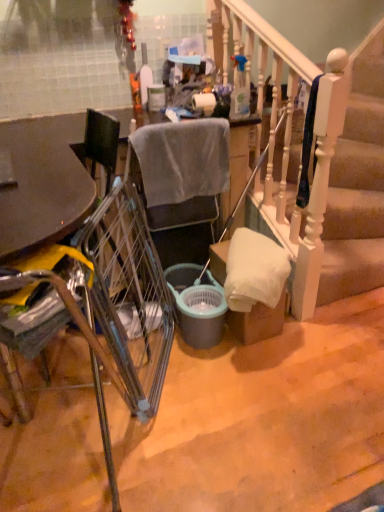
This screenshot has width=384, height=512. What do you see at coordinates (67, 318) in the screenshot? I see `metallic silver chair at left, arranged as the second chair when viewed from the back` at bounding box center [67, 318].

Measure the distance between point [199,105] and camera.

Point [199,105] is 2.13 meters away from camera.

The width and height of the screenshot is (384, 512). What do you see at coordinates (156, 97) in the screenshot?
I see `matte plastic trash can at center` at bounding box center [156, 97].

Identify the location of white wooden stairs at center. This screenshot has width=384, height=512. (342, 186).

Locate an element on the screen. The height and width of the screenshot is (512, 384). metallic silver chair at left, arranged as the second chair when viewed from the back is located at coordinates (67, 318).

Would you say metallic silver chair at left, marked as the first chair in a front-to-back arrangement, is to the left or to the right of matte gray bucket at center in the picture?

From the image, it's evident that metallic silver chair at left, marked as the first chair in a front-to-back arrangement, is to the left of matte gray bucket at center.

Is metallic silver chair at left, arranged as the second chair when viewed from the back, outside of matte gray bucket at center?

Yes, metallic silver chair at left, arranged as the second chair when viewed from the back, is not within matte gray bucket at center.

Between metallic silver chair at left, arranged as the second chair when viewed from the back, and matte gray bucket at center, which one has smaller width?

matte gray bucket at center.

Which point is more distant from viewer, [30,284] or [179,265]?

The point [179,265] is more distant.

Between white wooden stairs at center and matte gray bucket at center, which one appears on the left side from the viewer's perspective?

matte gray bucket at center is more to the left.

Is white wooden stairs at center touching matte gray bucket at center?

No, white wooden stairs at center is not beside matte gray bucket at center.

The width and height of the screenshot is (384, 512). Find the location of `stairs lying in front of the matte gray bucket at center`. stairs lying in front of the matte gray bucket at center is located at coordinates (342, 186).

Based on the photo, is white wooden stairs at center shorter than matte gray bucket at center?

Incorrect, the height of white wooden stairs at center does not fall short of that of matte gray bucket at center.

Would you say gray fabric chair at center, which is the first chair from back to front, contains matte gray bucket at center?

No, matte gray bucket at center is located outside of gray fabric chair at center, which is the first chair from back to front.

Locate an element on the screen. Image resolution: width=384 pixels, height=512 pixels. chair above the matte gray bucket at center (from the image's perspective) is located at coordinates (181, 170).

Which is closer to the camera, (x=213, y=234) or (x=216, y=328)?

Point (x=213, y=234) appears to be farther away from the viewer than point (x=216, y=328).

Which is behind, white matte toilet paper at center or metallic silver chair at left, arranged as the second chair when viewed from the back?

white matte toilet paper at center is further away from the camera.

Looking at this image, can you confirm if white matte toilet paper at center is positioned to the right of metallic silver chair at left, arranged as the second chair when viewed from the back?

Yes.

Which of these two, white matte toilet paper at center or metallic silver chair at left, marked as the first chair in a front-to-back arrangement, is wider?

With larger width is metallic silver chair at left, marked as the first chair in a front-to-back arrangement.

From the image's perspective, is white matte toilet paper at center positioned above or below metallic silver chair at left, marked as the first chair in a front-to-back arrangement?

Based on their image positions, white matte toilet paper at center is located above metallic silver chair at left, marked as the first chair in a front-to-back arrangement.

From the image's perspective, which one is positioned higher, matte gray bucket at center or white wooden stairs at center?

From the image's view, white wooden stairs at center is above.

How different are the orientations of matte gray bucket at center and white wooden stairs at center in degrees?

There is a 89.1-degree angle between the facing directions of matte gray bucket at center and white wooden stairs at center.

Is matte gray bucket at center oriented away from white wooden stairs at center?

No, matte gray bucket at center is not facing the opposite direction of white wooden stairs at center.

Is matte gray bucket at center situated inside white wooden stairs at center or outside?

matte gray bucket at center lies outside white wooden stairs at center.

Looking at the image, does matte gray bucket at center seem bigger or smaller compared to translucent plastic bottle at upper center, the first bottle in the left-to-right sequence?

Considering their sizes, matte gray bucket at center takes up more space than translucent plastic bottle at upper center, the first bottle in the left-to-right sequence.

The height and width of the screenshot is (512, 384). I want to click on bucket on the right side of translucent plastic bottle at upper center, the 1th bottle positioned from the back, so click(x=197, y=305).

Would you say matte gray bucket at center is outside translucent plastic bottle at upper center, the 1th bottle positioned from the back?

Absolutely, matte gray bucket at center is external to translucent plastic bottle at upper center, the 1th bottle positioned from the back.

Looking at this image, visually, is matte gray bucket at center positioned to the left or to the right of translucent plastic bottle at upper center, the first bottle in the left-to-right sequence?

From the image, it's evident that matte gray bucket at center is to the right of translucent plastic bottle at upper center, the first bottle in the left-to-right sequence.

Is clear plastic spray bottle at upper center, which ranks as the 2th bottle in left-to-right order, looking in the opposite direction of gray fabric chair at center, which is the first chair from back to front?

No, clear plastic spray bottle at upper center, which ranks as the 2th bottle in left-to-right order, is not facing the opposite direction of gray fabric chair at center, which is the first chair from back to front.

Which is closer, (241, 93) or (196, 207)?

The point (196, 207) is closer to the camera.

From their relative heights in the image, would you say clear plastic spray bottle at upper center, which ranks as the 2th bottle in left-to-right order, is taller or shorter than gray fabric chair at center, which is the first chair from back to front?

In the image, clear plastic spray bottle at upper center, which ranks as the 2th bottle in left-to-right order, appears to be shorter than gray fabric chair at center, which is the first chair from back to front.

Would you say clear plastic spray bottle at upper center, marked as the second bottle in a back-to-front arrangement, contains gray fabric chair at center, which is the first chair from back to front?

Definitely not — gray fabric chair at center, which is the first chair from back to front, is not inside clear plastic spray bottle at upper center, marked as the second bottle in a back-to-front arrangement.

Locate an element on the screen. bucket behind the metallic silver chair at left, marked as the first chair in a front-to-back arrangement is located at coordinates (197, 305).

Locate an element on the screen. This screenshot has width=384, height=512. stairs on the right side of matte gray bucket at center is located at coordinates (342, 186).

Based on their spatial positions, is metallic silver chair at left, arranged as the second chair when viewed from the back, or clear plastic spray bottle at upper center, marked as the first bottle in a right-to-left arrangement, closer to matte plastic trash can at center?

clear plastic spray bottle at upper center, marked as the first bottle in a right-to-left arrangement, is positioned closer to the anchor matte plastic trash can at center.

Looking at the image, which one is located closer to clear plastic spray bottle at upper center, marked as the first bottle in a right-to-left arrangement, white matte toilet paper at center or metallic silver chair at left, marked as the first chair in a front-to-back arrangement?

The object closer to clear plastic spray bottle at upper center, marked as the first bottle in a right-to-left arrangement, is white matte toilet paper at center.

Based on their spatial positions, is translucent plastic bottle at upper center, the 2th bottle from the front, or gray fabric chair at center, which is the first chair from back to front, closer to metallic silver trolley at center?

gray fabric chair at center, which is the first chair from back to front, is closer to metallic silver trolley at center.

Based on their spatial positions, is metallic silver trolley at center or clear plastic spray bottle at upper center, which appears as the first bottle when viewed from the front, closer to metallic silver chair at left, arranged as the second chair when viewed from the back?

metallic silver trolley at center lies closer to metallic silver chair at left, arranged as the second chair when viewed from the back, than the other object.

Based on their spatial positions, is metallic silver chair at left, marked as the first chair in a front-to-back arrangement, or metallic silver trolley at center further from white wooden stairs at center?

Based on the image, metallic silver chair at left, marked as the first chair in a front-to-back arrangement, appears to be further to white wooden stairs at center.

Which object lies further to the anchor point translucent plastic bottle at upper center, the 1th bottle positioned from the back, white matte toilet paper at center or metallic silver trolley at center?

metallic silver trolley at center.

Based on their spatial positions, is matte plastic trash can at center or clear plastic spray bottle at upper center, which appears as the first bottle when viewed from the front, closer to metallic silver trolley at center?

clear plastic spray bottle at upper center, which appears as the first bottle when viewed from the front, is closer to metallic silver trolley at center.

Which object lies further to the anchor point translucent plastic bottle at upper center, the 2th bottle from the front, gray fabric chair at center, the 2th chair when ordered from front to back, or metallic silver chair at left, marked as the first chair in a front-to-back arrangement?

metallic silver chair at left, marked as the first chair in a front-to-back arrangement, is positioned further to the anchor translucent plastic bottle at upper center, the 2th bottle from the front.

Find the location of a particular element. The image size is (384, 512). bottle that lies between translucent plastic bottle at upper center, the 1th bottle positioned from the back, and matte gray bucket at center from top to bottom is located at coordinates (239, 91).

Identify the location of chair located between metallic silver chair at left, marked as the first chair in a front-to-back arrangement, and white matte toilet paper at center in the depth direction. (181, 170).

Image resolution: width=384 pixels, height=512 pixels. I want to click on stairs between white matte toilet paper at center and matte gray bucket at center vertically, so click(x=342, y=186).

This screenshot has width=384, height=512. What are the coordinates of `toilet paper between matte plastic trash can at center and metallic silver trolley at center in the vertical direction` in the screenshot? It's located at (204, 102).